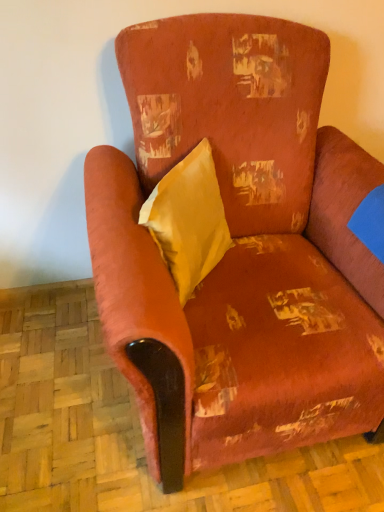
Question: In terms of height, does distressed velvet armchair at center look taller or shorter compared to yellow fabric pillow at center?

Choices:
 (A) tall
 (B) short

Answer: (A)

Question: Considering the positions of distressed velvet armchair at center and yellow fabric pillow at center in the image, is distressed velvet armchair at center bigger or smaller than yellow fabric pillow at center?

Choices:
 (A) small
 (B) big

Answer: (B)

Question: Is distressed velvet armchair at center inside or outside of yellow fabric pillow at center?

Choices:
 (A) inside
 (B) outside

Answer: (B)

Question: From the image's perspective, is yellow fabric pillow at center located above or below distressed velvet armchair at center?

Choices:
 (A) above
 (B) below

Answer: (A)

Question: Is yellow fabric pillow at center to the left or to the right of distressed velvet armchair at center in the image?

Choices:
 (A) left
 (B) right

Answer: (A)

Question: Choose the correct answer: Is yellow fabric pillow at center inside distressed velvet armchair at center or outside it?

Choices:
 (A) inside
 (B) outside

Answer: (A)

Question: Considering the positions of yellow fabric pillow at center and distressed velvet armchair at center in the image, is yellow fabric pillow at center taller or shorter than distressed velvet armchair at center?

Choices:
 (A) short
 (B) tall

Answer: (A)